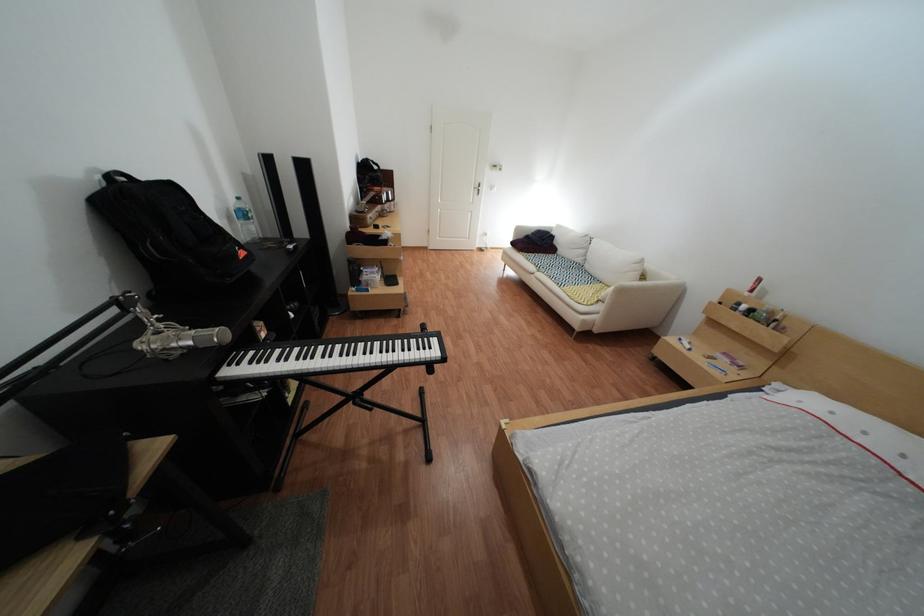
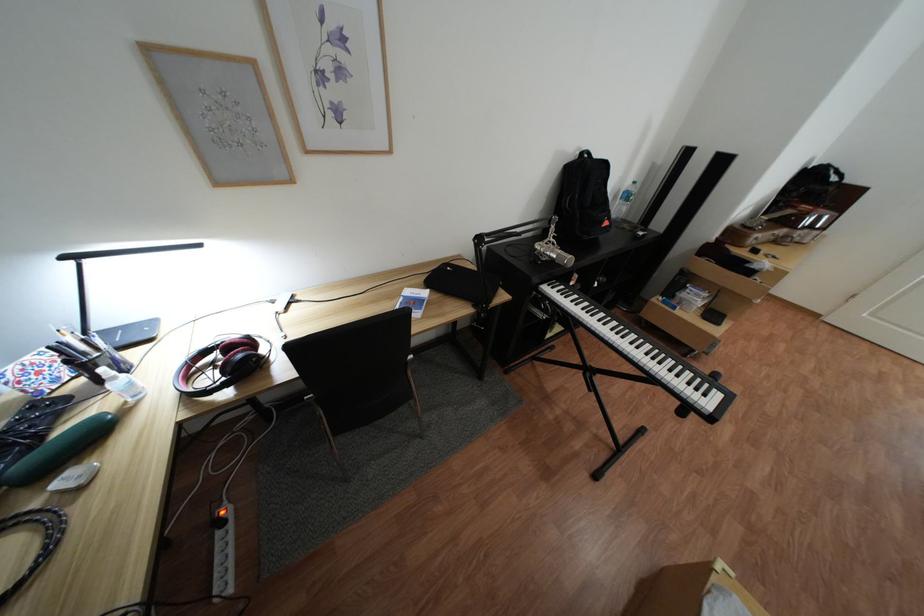
The images are taken continuously from a first-person perspective. In which direction is your viewpoint rotating?

The camera rotated toward left-down.